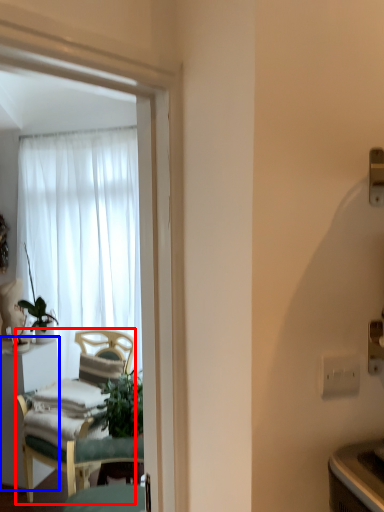
Question: Which of the following is the closest to the observer, chair (highlighted by a red box) or desk (highlighted by a blue box)?

Choices:
 (A) chair
 (B) desk

Answer: (A)